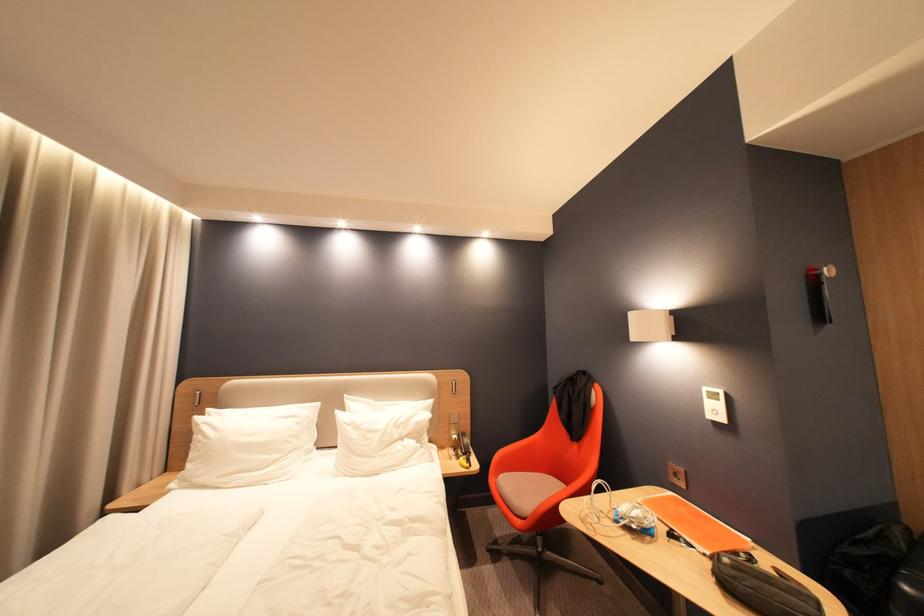
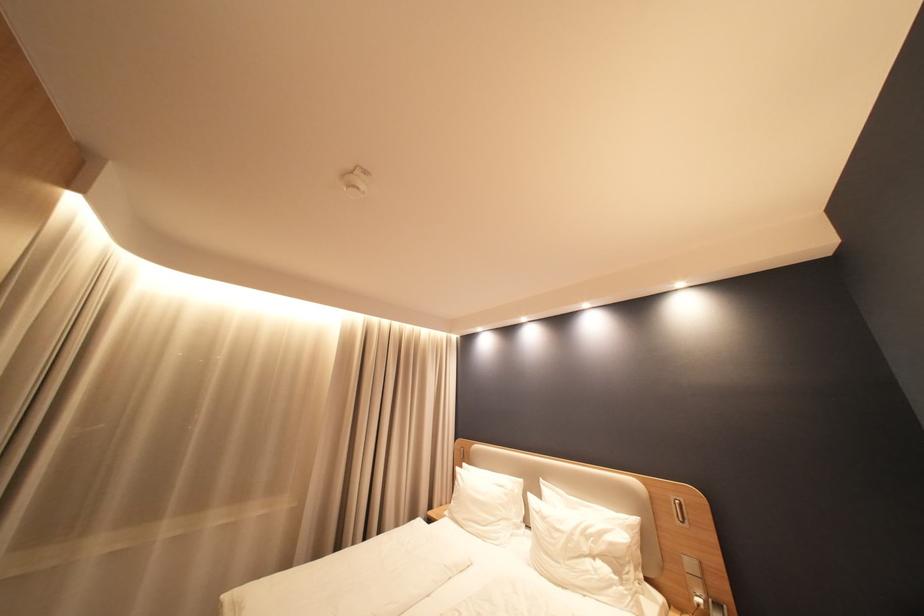
Find the pixel in the second image that matches point 359,424 in the first image.

(546, 511)